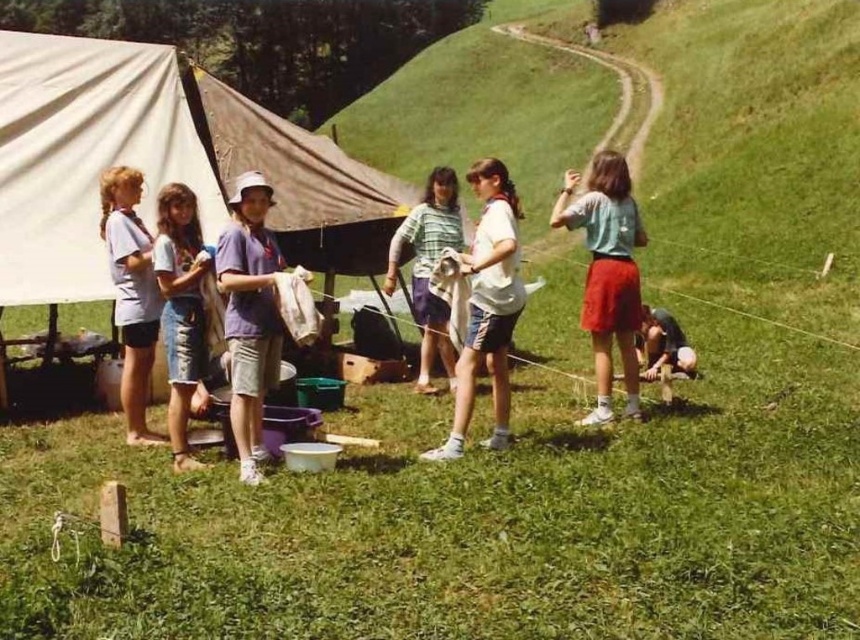
Does purple cotton shirt at center have a greater width compared to dark gray fabric at lower right?

Correct, the width of purple cotton shirt at center exceeds that of dark gray fabric at lower right.

Is purple cotton shirt at center below dark gray fabric at lower right?

No, purple cotton shirt at center is not below dark gray fabric at lower right.

You are a GUI agent. You are given a task and a screenshot of the screen. Output one action in this format:
    pyautogui.click(x=<x>, y=<y>)
    Task: Click on the purple cotton shirt at center
    Image resolution: width=860 pixels, height=640 pixels.
    Given the screenshot: What is the action you would take?
    pyautogui.click(x=250, y=314)

Based on the photo, which of these two, white canvas tent at left or purple cotton shirt at center, stands shorter?

white canvas tent at left is shorter.

Does white canvas tent at left have a greater width compared to purple cotton shirt at center?

Indeed, white canvas tent at left has a greater width compared to purple cotton shirt at center.

This screenshot has height=640, width=860. Identify the location of white canvas tent at left. (154, 161).

This screenshot has height=640, width=860. Find the location of `white canvas tent at left`. white canvas tent at left is located at coordinates [154, 161].

Does white canvas tent at left have a smaller size compared to white cotton shirt at center?

Actually, white canvas tent at left might be larger than white cotton shirt at center.

Does white canvas tent at left have a greater width compared to white cotton shirt at center?

Yes.

Which is in front, point (88, 170) or point (498, 228)?

Point (498, 228) is more forward.

Identify the location of white canvas tent at left. (154, 161).